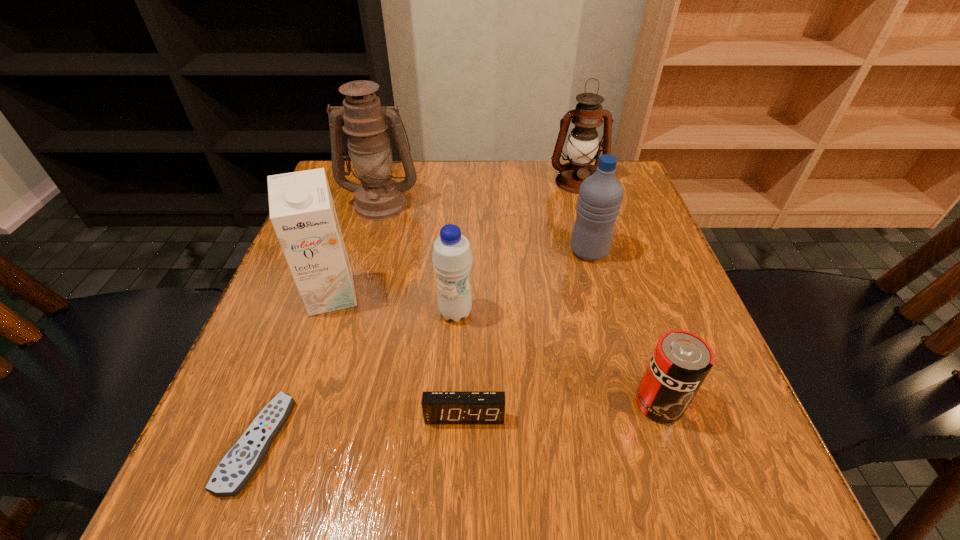
The image size is (960, 540). In order to click on oil lamp present at the left edge in this screenshot , I will do `click(378, 197)`.

You are a GUI agent. You are given a task and a screenshot of the screen. Output one action in this format:
    pyautogui.click(x=<x>, y=<y>)
    Task: Click on the carton that is at the left edge
    
    Given the screenshot: What is the action you would take?
    pyautogui.click(x=302, y=212)

Locate an element on the screen. The image size is (960, 540). remote control that is positioned at the left edge is located at coordinates (238, 466).

The image size is (960, 540). Identify the location of lantern located in the right edge section of the desktop. (583, 143).

Where is `water bottle present at the right edge`? water bottle present at the right edge is located at coordinates (600, 196).

You are a GUI agent. You are given a task and a screenshot of the screen. Output one action in this format:
    pyautogui.click(x=<x>, y=<y>)
    Task: Click on the can situated at the right edge
    This screenshot has width=960, height=540.
    Given the screenshot: What is the action you would take?
    pyautogui.click(x=681, y=361)

Identify the location of object situated at the far left corner. This screenshot has width=960, height=540. (378, 197).

Where is `object that is at the near left corner`? This screenshot has width=960, height=540. object that is at the near left corner is located at coordinates (238, 466).

Locate an element on the screen. The width and height of the screenshot is (960, 540). object that is at the far right corner is located at coordinates (583, 143).

Where is `free region at the far edge of the desktop`? This screenshot has width=960, height=540. free region at the far edge of the desktop is located at coordinates pyautogui.click(x=475, y=208).